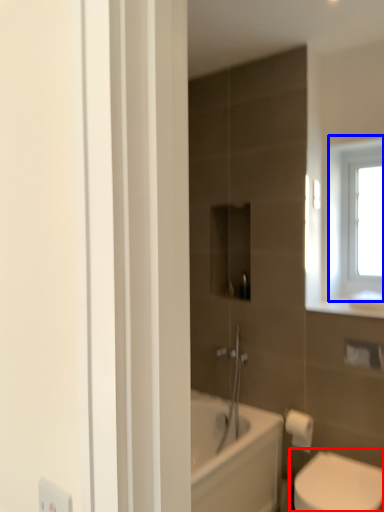
Question: Which object appears farthest to the camera in this image, toilet (highlighted by a red box) or window (highlighted by a blue box)?

Choices:
 (A) toilet
 (B) window

Answer: (B)